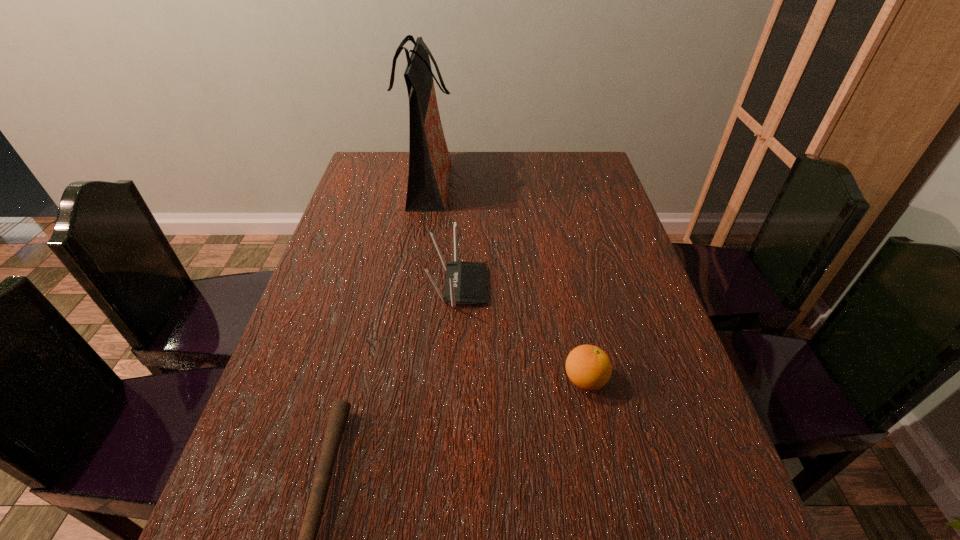
Find the location of a particular element. object that is at the left edge is located at coordinates (429, 161).

What are the coordinates of `object located in the right edge section of the desktop` in the screenshot? It's located at (588, 367).

You are a GUI agent. You are given a task and a screenshot of the screen. Output one action in this format:
    pyautogui.click(x=<x>, y=<y>)
    Task: Click on the object positioned at the far left corner
    Image resolution: width=960 pixels, height=540 pixels.
    Given the screenshot: What is the action you would take?
    pyautogui.click(x=429, y=161)

Identify the location of free space at the far edge of the desktop. The height and width of the screenshot is (540, 960). (555, 184).

Find the location of a particular element. Image resolution: width=960 pixels, height=540 pixels. vacant region at the right edge of the desktop is located at coordinates (640, 286).

Find the location of a particular element. The image size is (960, 540). vacant space at the far right corner of the desktop is located at coordinates (571, 185).

Find the location of a particular element. This screenshot has height=540, width=960. vacant space that's between the rightmost object and the tallest object is located at coordinates (506, 284).

The height and width of the screenshot is (540, 960). What are the coordinates of `free space that is in between the third shortest object and the second nearest object` in the screenshot? It's located at (522, 333).

Locate an element on the screen. The image size is (960, 540). free point between the second farthest object and the tallest object is located at coordinates (443, 237).

Identify the location of object that is the third closest to the router. (340, 409).